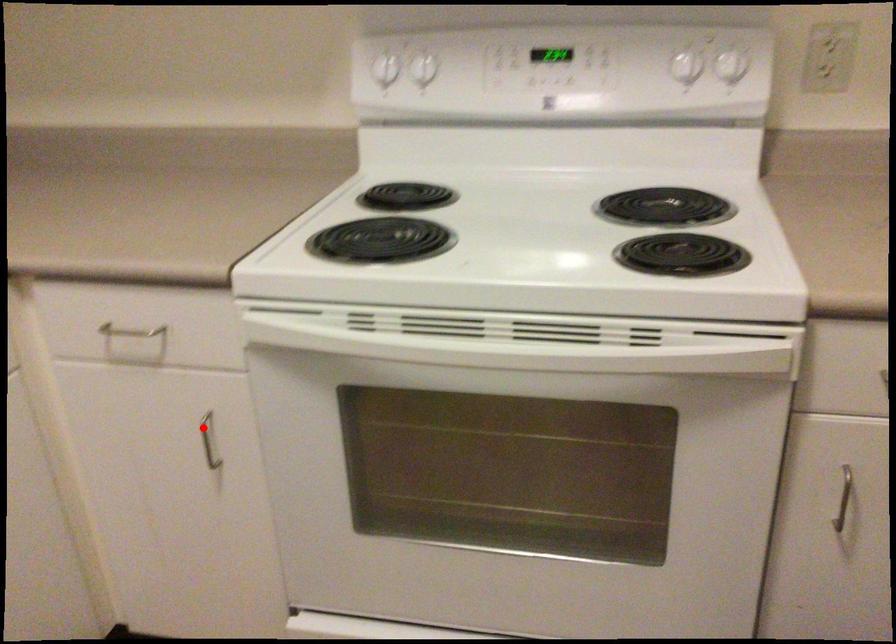
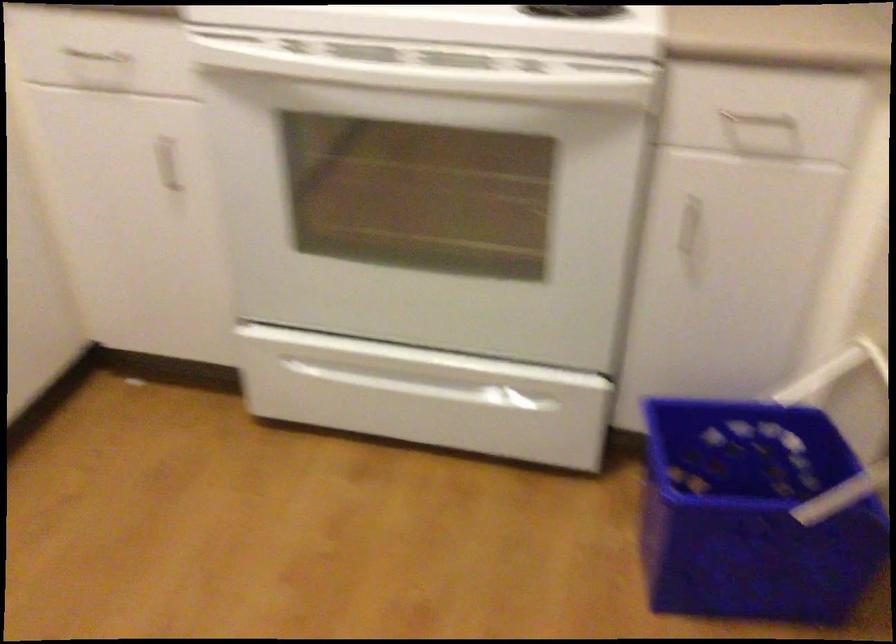
Locate, in the second image, the point that corresponds to the highlighted location in the first image.

(167, 164)